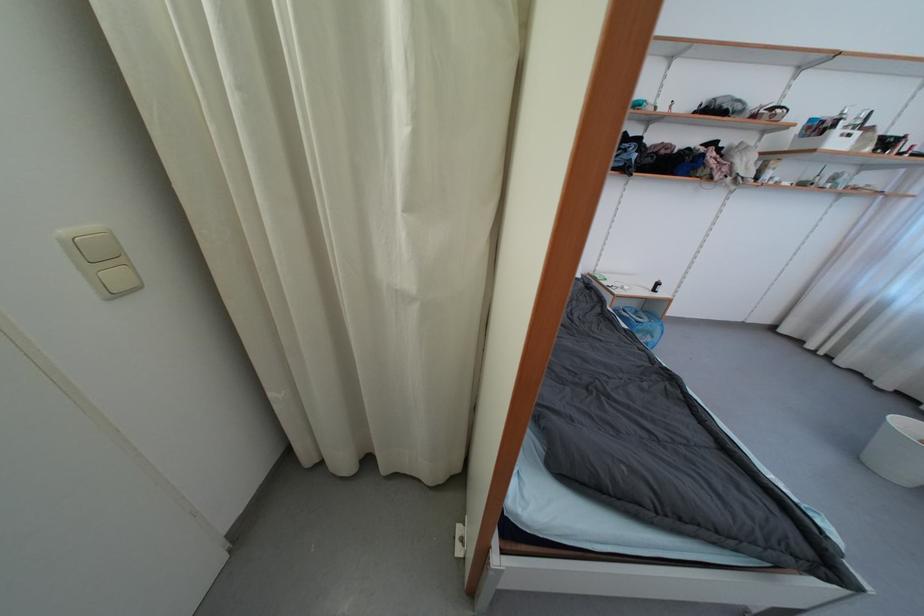
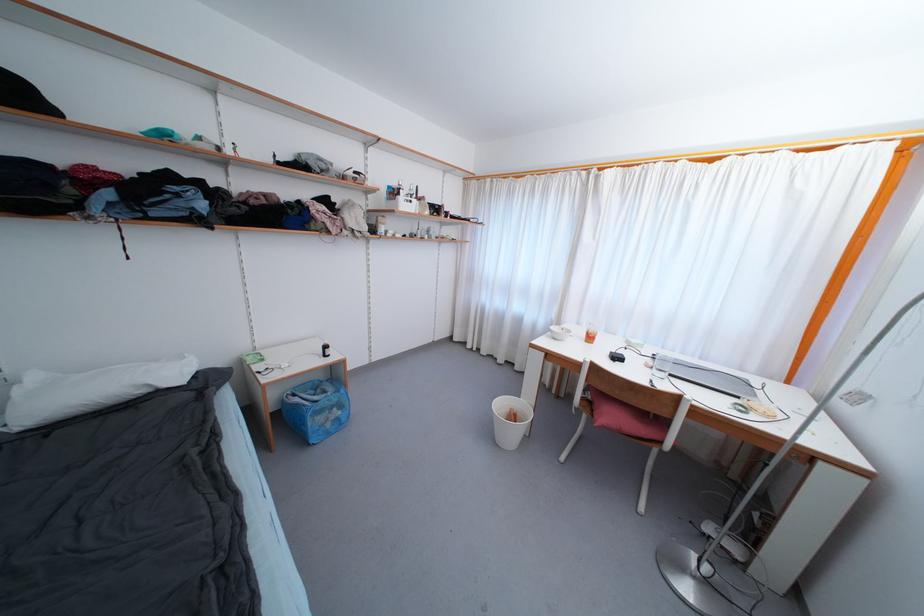
In the second image, find the point that corresponds to point 662,286 in the first image.

(330, 350)